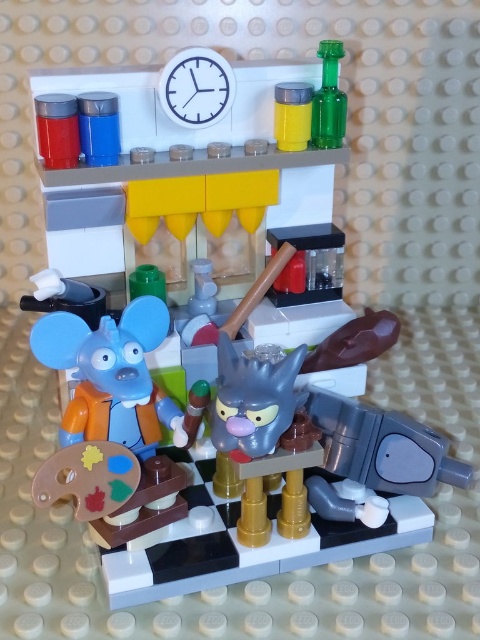
You are a visitor looking at the LEGO diorama. You notice the white plastic clock at upper center and the green glass bottle at upper right. Which object is located higher up in the image?

The green glass bottle at upper right is higher up because the white plastic clock at upper center is positioned under it.

You are standing in front of the LEGO diorama and want to know which of the two points, point 1 at coordinates point (214, 67) or point 2 at coordinates point (326, 45), is closer to you. Based on the scene description, which point is closer?

Point 1 at coordinates point (214, 67) is closer to you because it is in front of point 2 at coordinates point (326, 45).